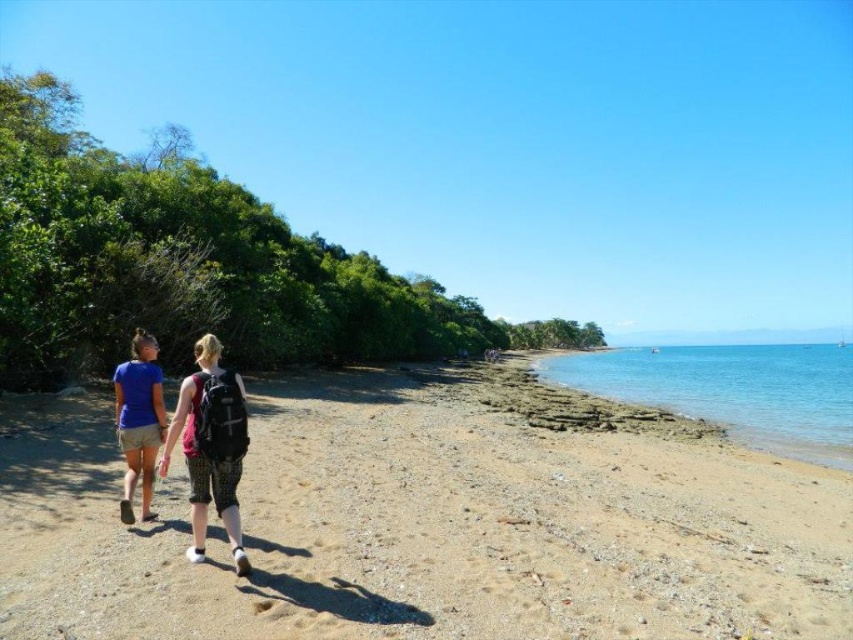
Is brown sandy beach at center wider than matte black backpack at lower left?

Correct, the width of brown sandy beach at center exceeds that of matte black backpack at lower left.

Where is `brown sandy beach at center`? brown sandy beach at center is located at coordinates (427, 522).

Is point (196, 522) positioned behind point (155, 384)?

No, it is not.

Which is above, matte black backpack at lower left or blue fabric shorts at lower left?

blue fabric shorts at lower left

What are the coordinates of `matte black backpack at lower left` in the screenshot? It's located at (207, 444).

The width and height of the screenshot is (853, 640). What are the coordinates of `matte black backpack at lower left` in the screenshot? It's located at (207, 444).

Consider the image. Is clear blue water at right to the left of blue fabric shorts at lower left from the viewer's perspective?

No, clear blue water at right is not to the left of blue fabric shorts at lower left.

Can you confirm if clear blue water at right is taller than blue fabric shorts at lower left?

Correct, clear blue water at right is much taller as blue fabric shorts at lower left.

Image resolution: width=853 pixels, height=640 pixels. I want to click on clear blue water at right, so click(x=732, y=390).